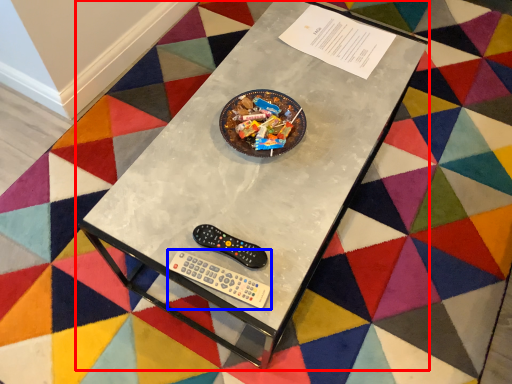
Question: Which of the following is the closest to the observer, table (highlighted by a red box) or Wii controller (highlighted by a blue box)?

Choices:
 (A) table
 (B) Wii controller

Answer: (A)